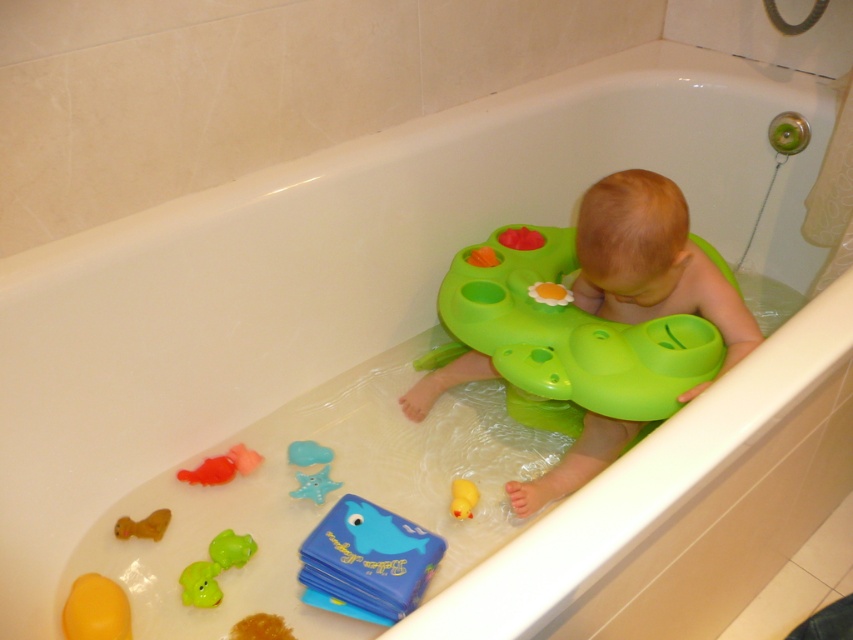
You are a parent looking into the bathtub. You see the green rubber seat at center and the blue rubber starfish at lower center. Which object is closer to you?

The green rubber seat at center is closer to the viewer than the blue rubber starfish at lower center.